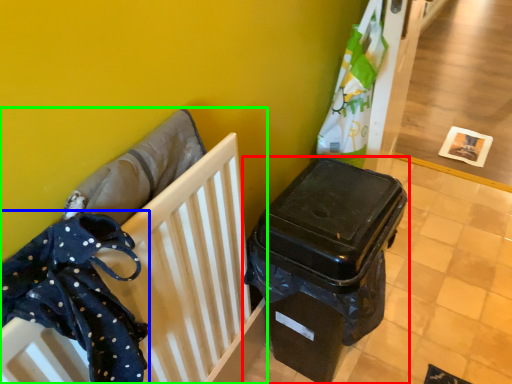
Question: Estimate the real-world distances between objects in this image. Which object is farther from waste container (highlighted by a red box), clothe (highlighted by a blue box) or furniture (highlighted by a green box)?

Choices:
 (A) clothe
 (B) furniture

Answer: (A)